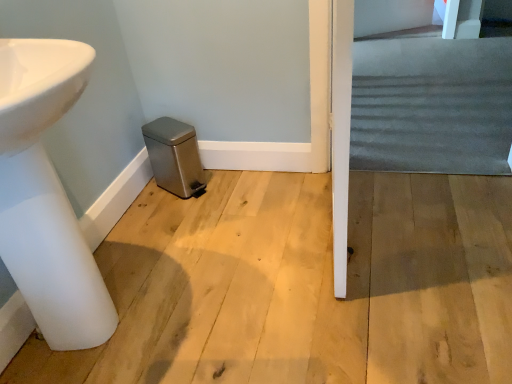
Locate an element on the screen. The image size is (512, 384). free point behind white glossy sink at lower left is located at coordinates 163,231.